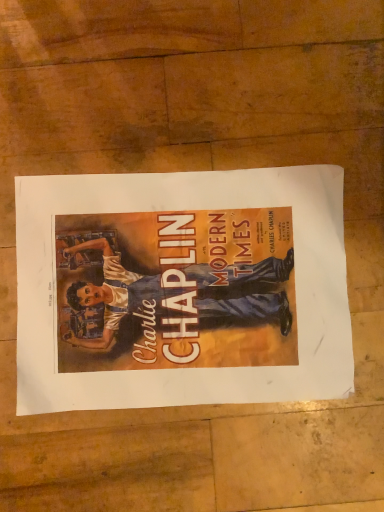
Identify the location of matte paper poster at center. (181, 289).

What do you see at coordinates (181, 289) in the screenshot? The width and height of the screenshot is (384, 512). I see `matte paper poster at center` at bounding box center [181, 289].

Measure the distance between point (269, 210) and camera.

Point (269, 210) is 15.04 inches from camera.

Image resolution: width=384 pixels, height=512 pixels. What are the coordinates of `matte paper poster at center` in the screenshot? It's located at (181, 289).